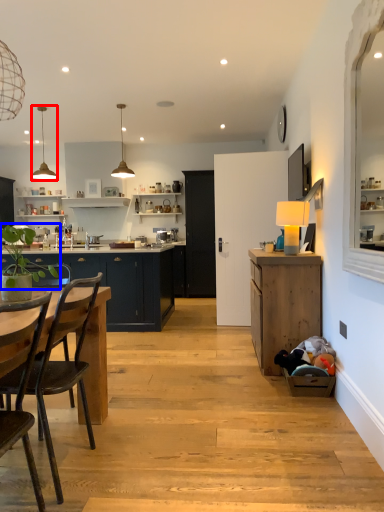
Question: Which point is further to the camera, lamp (highlighted by a red box) or plant (highlighted by a blue box)?

Choices:
 (A) lamp
 (B) plant

Answer: (A)